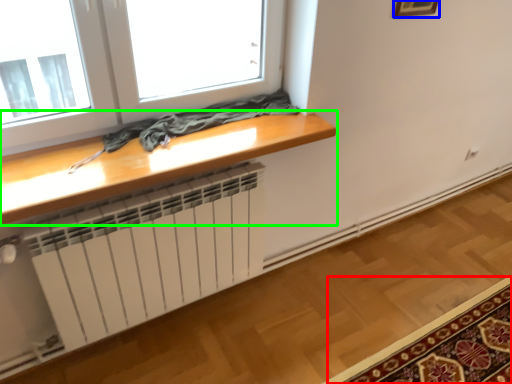
Question: Estimate the real-world distances between objects in this image. Which object is farther from mat (highlighted by a red box), picture frame (highlighted by a blue box) or table (highlighted by a green box)?

Choices:
 (A) picture frame
 (B) table

Answer: (A)